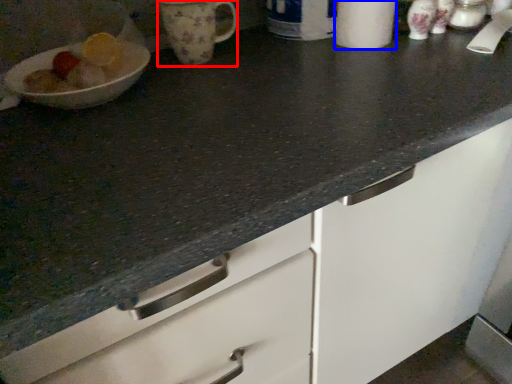
Question: Which point is closer to the camera, mug (highlighted by a red box) or paper towel (highlighted by a blue box)?

Choices:
 (A) mug
 (B) paper towel

Answer: (B)